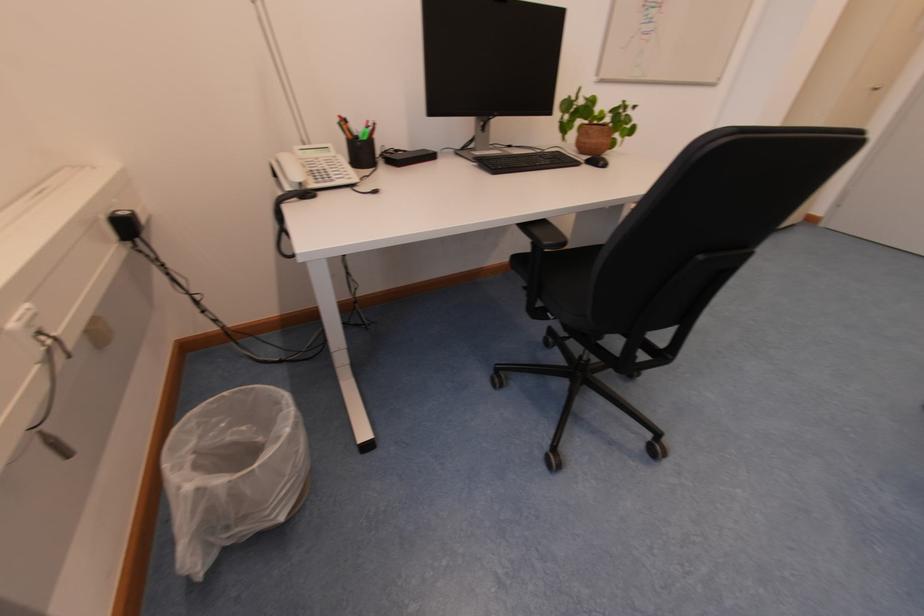
This screenshot has height=616, width=924. I want to click on black power plug, so click(x=120, y=217).